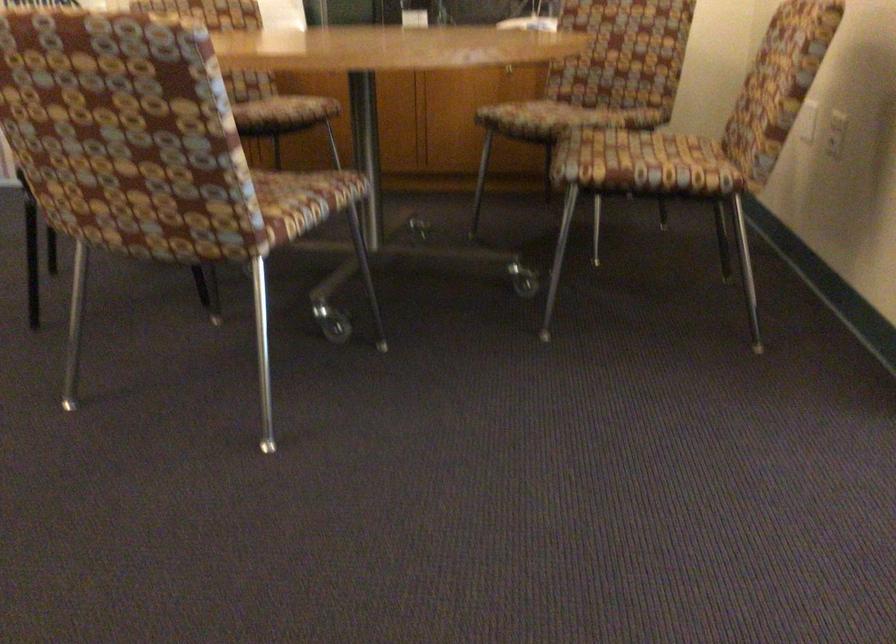
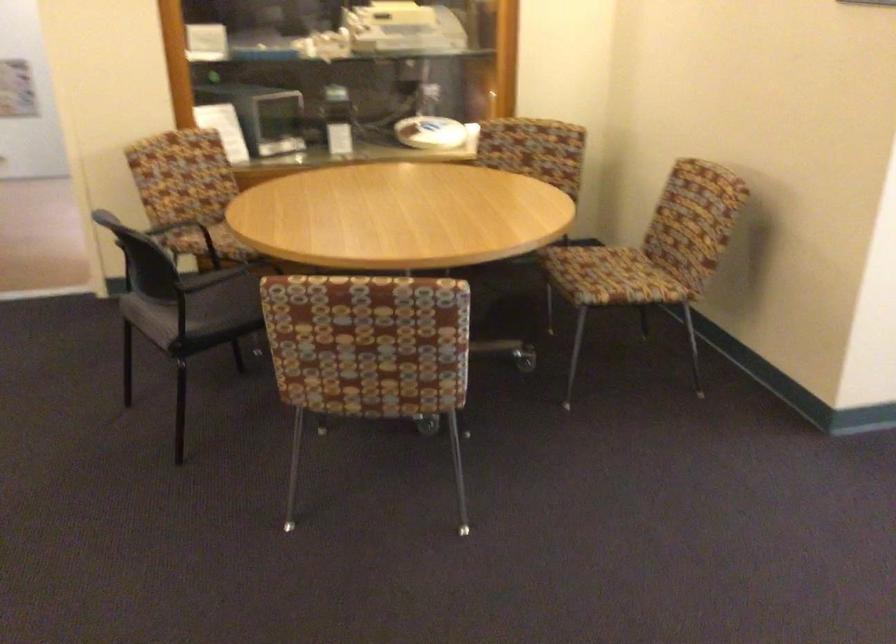
Find the pixel in the second image that matches (721,153) in the first image.

(652, 254)